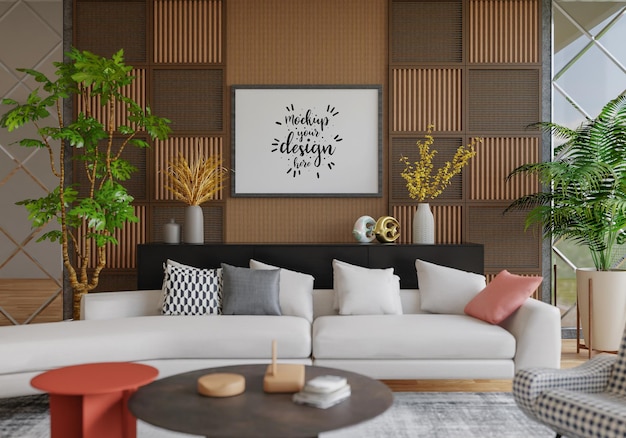
The height and width of the screenshot is (438, 626). Identify the location of gray vase. (191, 227).